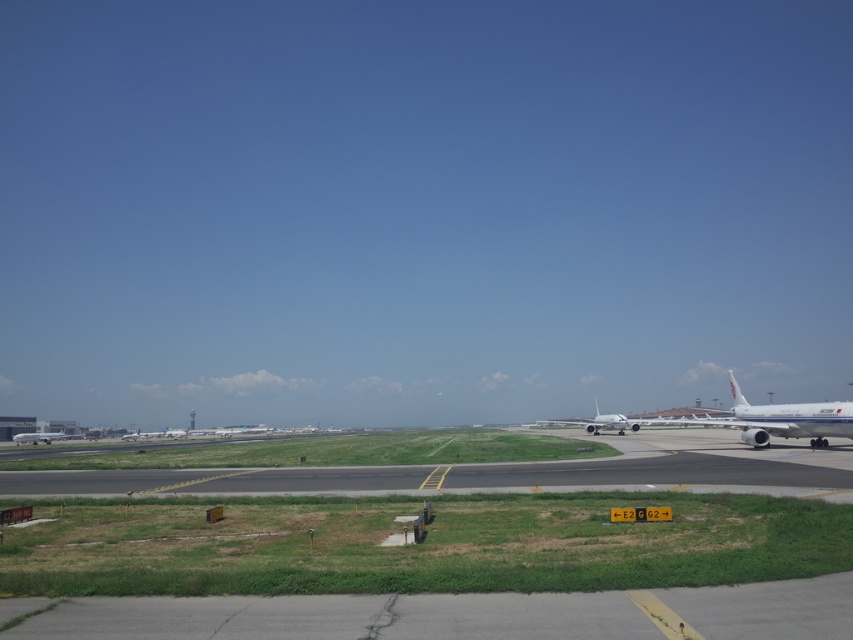
You are a pilot preparing to taxi your plane to gate E2. You need to know if the black asphalt runway at center is shorter than the metallic silver airplane at center to ensure safe clearance. Can you confirm this?

The black asphalt runway at center is not as tall as the metallic silver airplane at center, so the runway is shorter in height. This means there should be sufficient vertical clearance for the airplane to taxi safely.

You are an airport maintenance worker and need to access the white glossy airplane at right for inspection. However, there is a black asphalt runway at center in the way. Can you safely walk around the runway to reach the airplane?

The black asphalt runway at center is positioned over white glossy airplane at right, meaning the runway is covering the airplane. Therefore, you cannot safely walk around the runway to reach the white glossy airplane at right as it is already under the runway.